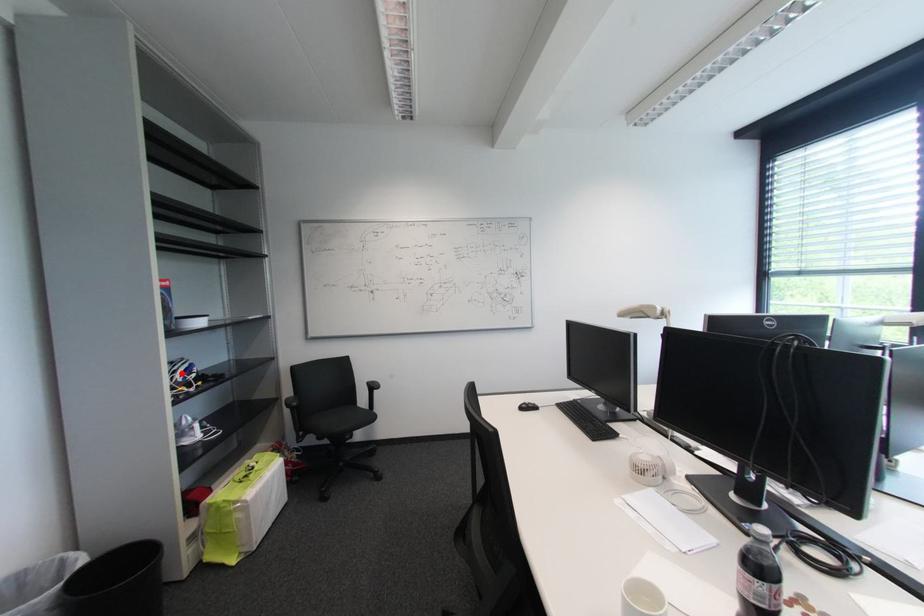
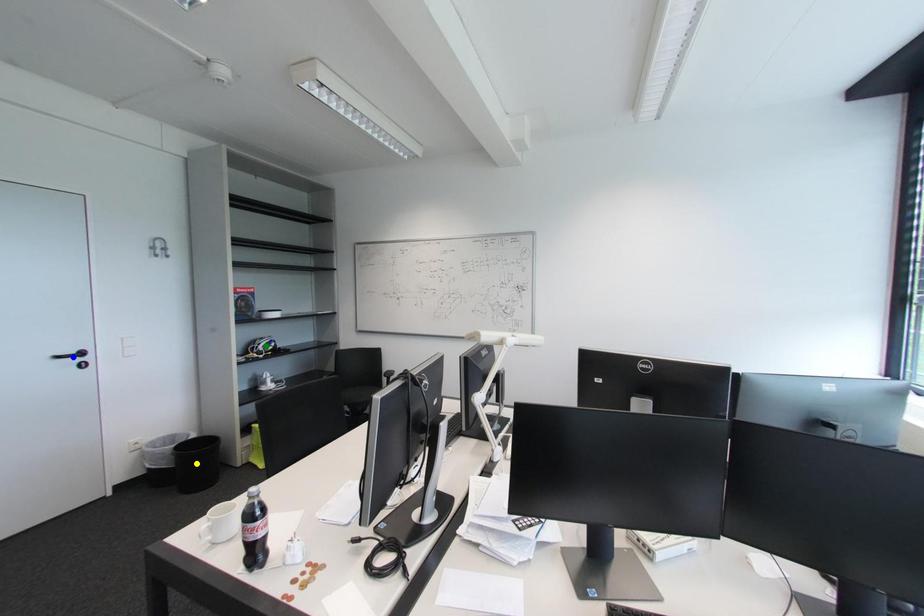
Question: I am providing you with two images of the same scene from different viewpoints. A red point is marked on the first image. You are given multiple points on the second image. Can you choose the point in image 2 that corresponds to the point in image 1?

Choices:
 (A) yellow point
 (B) blue point
 (C) green point

Answer: (C)